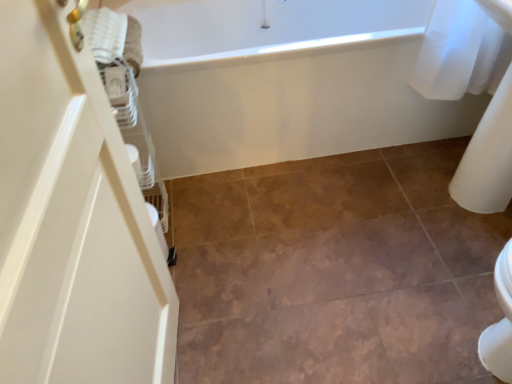
Question: Considering the positions of point (370, 61) and point (119, 43), is point (370, 61) closer or farther from the camera than point (119, 43)?

Choices:
 (A) closer
 (B) farther

Answer: (B)

Question: Considering the positions of white glossy bathtub at upper center and white textured towel at upper left in the image, is white glossy bathtub at upper center bigger or smaller than white textured towel at upper left?

Choices:
 (A) small
 (B) big

Answer: (B)

Question: Which is farther from the white textured towel at upper left?

Choices:
 (A) brown matte tile at center
 (B) white glossy bathtub at upper center

Answer: (A)

Question: Which of these objects is positioned closest to the brown matte tile at center?

Choices:
 (A) white glossy bathtub at upper center
 (B) white textured towel at upper left

Answer: (A)